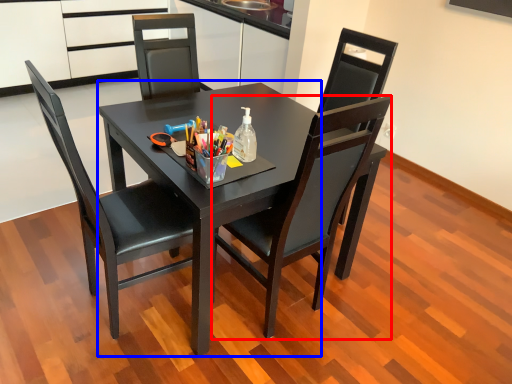
Question: Among these objects, which one is farthest to the camera, chair (highlighted by a red box) or round table (highlighted by a blue box)?

Choices:
 (A) chair
 (B) round table

Answer: (B)